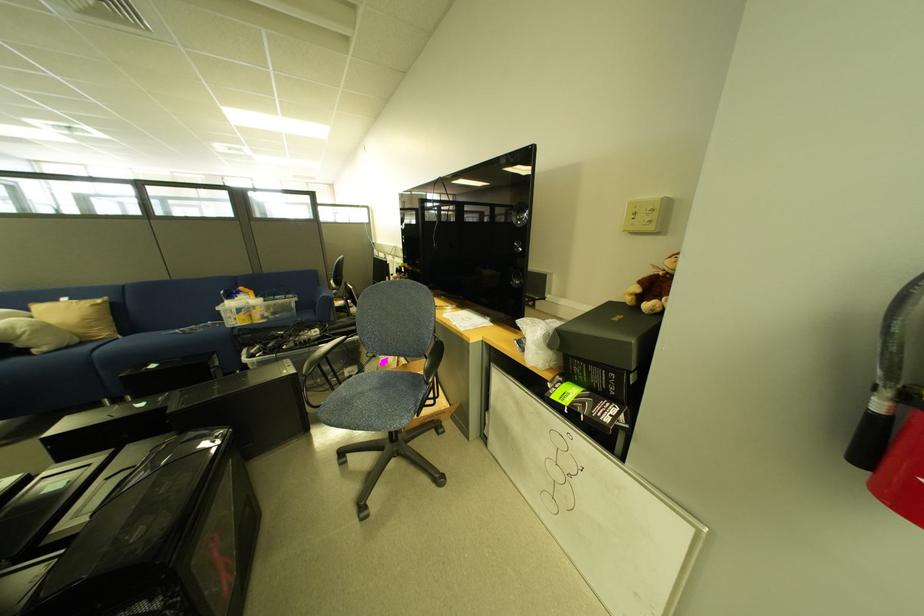
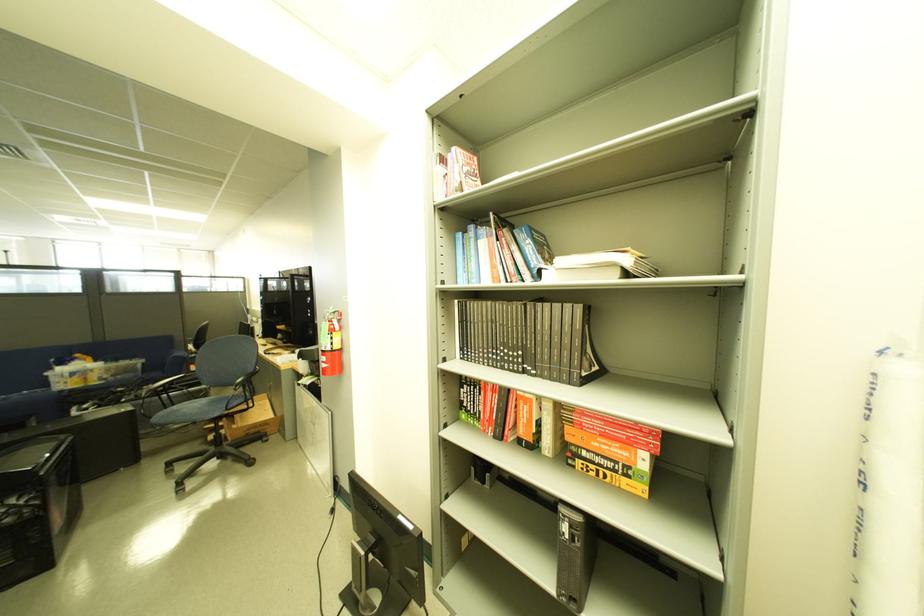
Locate, in the second image, the point that corresponds to the point at 350,386 in the first image.

(185, 408)